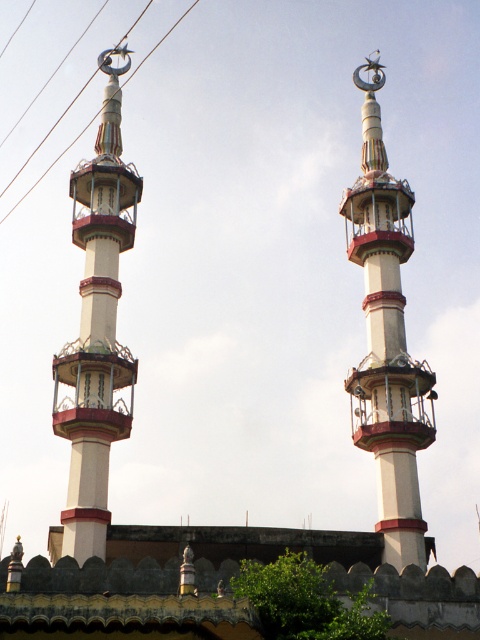
From the picture: Is white glossy minaret at center wider than metallic wire at upper center?

No, white glossy minaret at center is not wider than metallic wire at upper center.

Which is in front, point (370, 365) or point (46, 173)?

Point (370, 365)

Image resolution: width=480 pixels, height=640 pixels. What are the coordinates of `white glossy minaret at center` in the screenshot? It's located at (386, 339).

Does white painted metal minaret at left have a larger size compared to metallic wire at upper center?

Indeed, white painted metal minaret at left has a larger size compared to metallic wire at upper center.

Is white painted metal minaret at left closer to camera compared to metallic wire at upper center?

That is True.

Image resolution: width=480 pixels, height=640 pixels. What do you see at coordinates (96, 326) in the screenshot?
I see `white painted metal minaret at left` at bounding box center [96, 326].

The height and width of the screenshot is (640, 480). I want to click on white painted metal minaret at left, so click(x=96, y=326).

Can you confirm if white painted metal minaret at left is positioned below white glossy minaret at center?

Yes.

Is white painted metal minaret at left further to camera compared to white glossy minaret at center?

That is False.

Describe the element at coordinates (96, 326) in the screenshot. I see `white painted metal minaret at left` at that location.

Locate an element on the screen. Image resolution: width=480 pixels, height=640 pixels. white painted metal minaret at left is located at coordinates (96, 326).